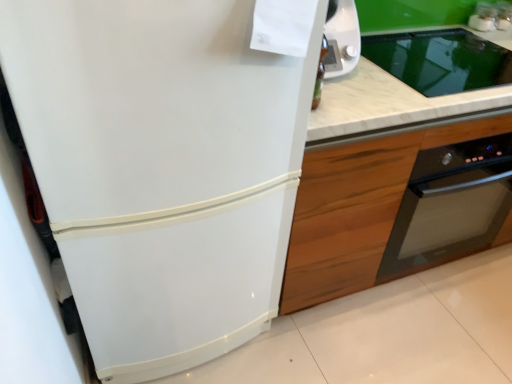
What do you see at coordinates (161, 168) in the screenshot? I see `white glossy refrigerator at left` at bounding box center [161, 168].

In order to face white glossy refrigerator at left, should I rotate leftwards or rightwards?

Turn left by 11.394 degrees to look at white glossy refrigerator at left.

Where is `white glossy refrigerator at left`? white glossy refrigerator at left is located at coordinates (161, 168).

Is white marble countertop at center facing away from white glossy refrigerator at left?

No, white marble countertop at center is not facing the opposite direction of white glossy refrigerator at left.

Considering the sizes of objects white marble countertop at center and white glossy refrigerator at left in the image provided, who is wider, white marble countertop at center or white glossy refrigerator at left?

white glossy refrigerator at left is wider.

Consider the image. How distant is white marble countertop at center from white glossy refrigerator at left?

A distance of 18.84 inches exists between white marble countertop at center and white glossy refrigerator at left.

Where is `refrigerator in front of the white marble countertop at center`? refrigerator in front of the white marble countertop at center is located at coordinates (161, 168).

Considering the relative sizes of wooden cabinet at right and white glossy refrigerator at left in the image provided, is wooden cabinet at right wider than white glossy refrigerator at left?

No, wooden cabinet at right is not wider than white glossy refrigerator at left.

Which is correct: wooden cabinet at right is inside white glossy refrigerator at left, or outside of it?

wooden cabinet at right is located beyond the bounds of white glossy refrigerator at left.

Is wooden cabinet at right at the right side of white glossy refrigerator at left?

Yes.

Considering the sizes of objects wooden cabinet at right and white glossy refrigerator at left in the image provided, who is bigger, wooden cabinet at right or white glossy refrigerator at left?

white glossy refrigerator at left.

Can you confirm if white glossy refrigerator at left is smaller than wooden cabinet at right?

Actually, white glossy refrigerator at left might be larger than wooden cabinet at right.

Based on the photo, which of these two, white glossy refrigerator at left or wooden cabinet at right, stands taller?

With more height is white glossy refrigerator at left.

Which is behind, point (79, 227) or point (395, 152)?

Positioned behind is point (395, 152).

Does white glossy refrigerator at left lie in front of wooden cabinet at right?

Yes, white glossy refrigerator at left is in front of wooden cabinet at right.

Which object is further away from the camera, wooden cabinet at right or white marble countertop at center?

wooden cabinet at right is further away from the camera.

Is wooden cabinet at right taller or shorter than white marble countertop at center?

Clearly, wooden cabinet at right is taller compared to white marble countertop at center.

Would you say wooden cabinet at right is inside or outside white marble countertop at center?

wooden cabinet at right is outside white marble countertop at center.

Does wooden cabinet at right have a smaller size compared to white marble countertop at center?

No.

Is white marble countertop at center to the right of wooden cabinet at right from the viewer's perspective?

No, white marble countertop at center is not to the right of wooden cabinet at right.

In the scene shown: Is white marble countertop at center bigger or smaller than wooden cabinet at right?

Clearly, white marble countertop at center is smaller in size than wooden cabinet at right.

In the scene shown: Would you say white marble countertop at center is outside wooden cabinet at right?

white marble countertop at center lies outside wooden cabinet at right's area.

Considering the sizes of objects white marble countertop at center and wooden cabinet at right in the image provided, who is thinner, white marble countertop at center or wooden cabinet at right?

white marble countertop at center is thinner.

From a real-world perspective, who is located higher, white glossy refrigerator at left or white marble countertop at center?

white marble countertop at center is physically above.

I want to click on refrigerator that appears in front of the white marble countertop at center, so click(x=161, y=168).

Is white glossy refrigerator at left further to the viewer compared to white marble countertop at center?

No, the depth of white glossy refrigerator at left is less than that of white marble countertop at center.

Between white glossy refrigerator at left and white marble countertop at center, which one has smaller width?

white marble countertop at center is thinner.

Find the location of a particular element. The height and width of the screenshot is (384, 512). refrigerator located underneath the white marble countertop at center (from a real-world perspective) is located at coordinates (161, 168).

Find the location of a particular element. cabinetry lying behind the white glossy refrigerator at left is located at coordinates (357, 209).

Considering their positions, is wooden cabinet at right positioned closer to white glossy refrigerator at left than white marble countertop at center?

wooden cabinet at right lies closer to white glossy refrigerator at left than the other object.

Considering their positions, is wooden cabinet at right positioned closer to white marble countertop at center than white glossy refrigerator at left?

Among the two, wooden cabinet at right is located nearer to white marble countertop at center.

Looking at the image, which one is located closer to white marble countertop at center, white glossy refrigerator at left or wooden cabinet at right?

The object closer to white marble countertop at center is wooden cabinet at right.

Considering their positions, is white glossy refrigerator at left positioned further to wooden cabinet at right than white marble countertop at center?

white glossy refrigerator at left lies further to wooden cabinet at right than the other object.

From the picture: Which object lies nearer to the anchor point white glossy refrigerator at left, white marble countertop at center or wooden cabinet at right?

The object closer to white glossy refrigerator at left is wooden cabinet at right.

Looking at the image, which one is located closer to wooden cabinet at right, white marble countertop at center or white glossy refrigerator at left?

The object closer to wooden cabinet at right is white marble countertop at center.

Find the location of a particular element. The height and width of the screenshot is (384, 512). countertop between white glossy refrigerator at left and wooden cabinet at right is located at coordinates (394, 99).